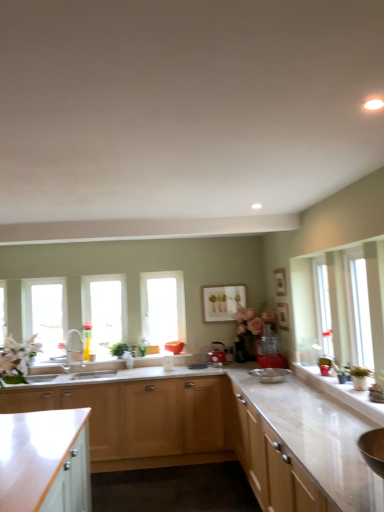
In order to click on free point above clear glass window at center, the 2th window from the right (from a real-world perspective) in this screenshot , I will do `click(103, 276)`.